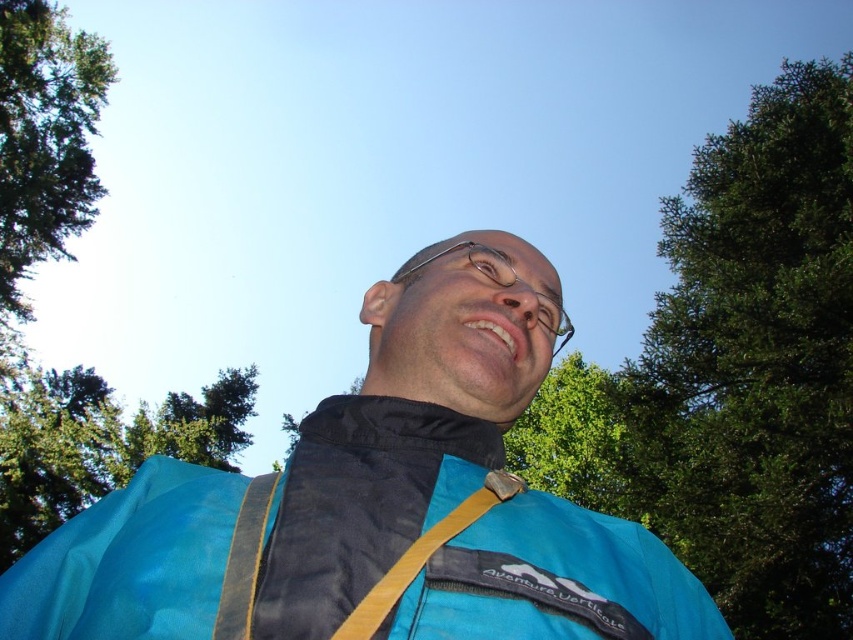
Question: Which point is farther to the camera?

Choices:
 (A) clear plastic glasses at center
 (B) yellow fabric strap at center
 (C) green leafy tree at center

Answer: (A)

Question: Does blue fabric jacket at center appear under clear plastic glasses at center?

Choices:
 (A) yes
 (B) no

Answer: (A)

Question: Which object is closer to the camera taking this photo?

Choices:
 (A) yellow fabric strap at center
 (B) clear plastic glasses at center
 (C) green leafy tree at center
 (D) green leafy tree at upper right

Answer: (A)

Question: Which object appears closest to the camera in this image?

Choices:
 (A) green leafy tree at upper right
 (B) green leafy tree at center

Answer: (B)

Question: Does green leafy tree at upper right come behind clear plastic glasses at center?

Choices:
 (A) no
 (B) yes

Answer: (B)

Question: Is green leafy tree at center wider than yellow fabric strap at center?

Choices:
 (A) no
 (B) yes

Answer: (B)